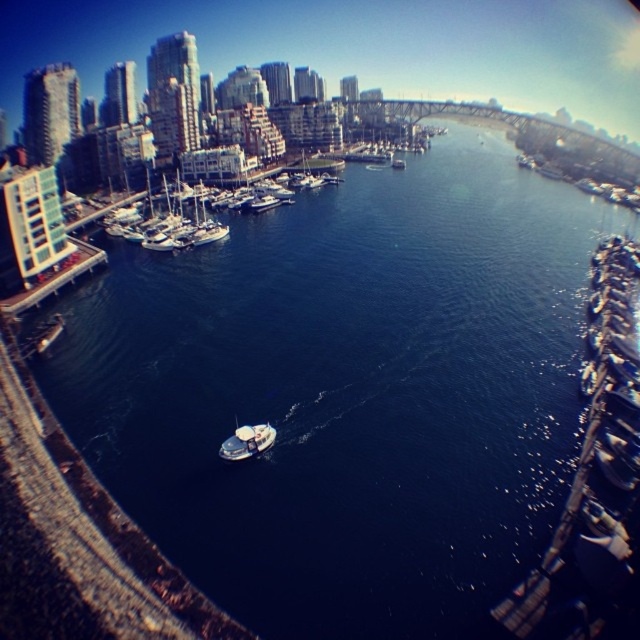
Between smooth concrete dock at left and white matte boat at center-left, which one appears on the right side from the viewer's perspective?

From the viewer's perspective, white matte boat at center-left appears more on the right side.

At what (x,y) coordinates should I click in order to perform the action: click on smooth concrete dock at left. Please return your answer as a coordinate pair (x, y). This screenshot has height=640, width=640. Looking at the image, I should click on (54, 278).

The width and height of the screenshot is (640, 640). I want to click on smooth concrete dock at left, so click(x=54, y=278).

Based on the photo, is white matte boats at center below smooth concrete dock at left?

No, white matte boats at center is not below smooth concrete dock at left.

Is white matte boats at center wider than smooth concrete dock at left?

Indeed, white matte boats at center has a greater width compared to smooth concrete dock at left.

Identify the location of white matte boats at center. Image resolution: width=640 pixels, height=640 pixels. (264, 182).

Where is `white matte boats at center`? This screenshot has height=640, width=640. white matte boats at center is located at coordinates (264, 182).

Can you confirm if white matte boats at center is shorter than white matte boat at center-left?

No.

The width and height of the screenshot is (640, 640). Find the location of `white matte boats at center`. white matte boats at center is located at coordinates [x=264, y=182].